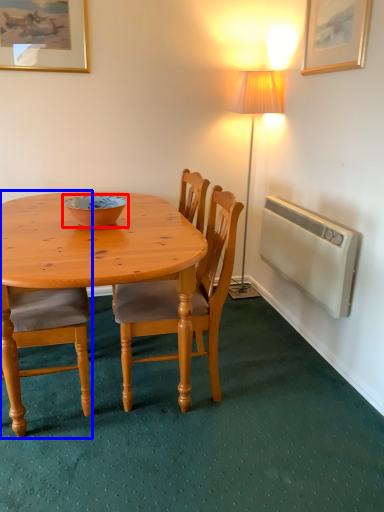
Question: Which of the following is the farthest to the observer, bowl (highlighted by a red box) or chair (highlighted by a blue box)?

Choices:
 (A) bowl
 (B) chair

Answer: (A)